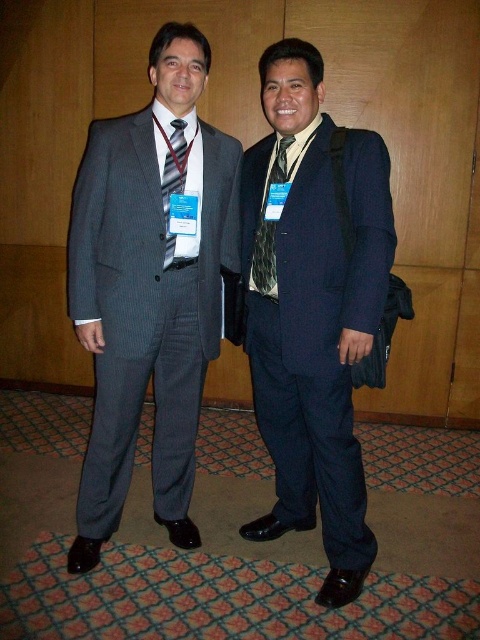
Which is more to the left, gray pinstripe suit at left or patterned silk tie at center?

Positioned to the left is gray pinstripe suit at left.

Where is `gray pinstripe suit at left`? This screenshot has height=640, width=480. gray pinstripe suit at left is located at coordinates (148, 291).

Locate an element on the screen. The height and width of the screenshot is (640, 480). gray pinstripe suit at left is located at coordinates (148, 291).

Can you confirm if gray pinstripe suit at left is thinner than navy blue suit at center?

No.

I want to click on gray pinstripe suit at left, so click(x=148, y=291).

Who is more distant from viewer, (x=186, y=106) or (x=328, y=556)?

The point (x=328, y=556) is behind.

Locate an element on the screen. gray pinstripe suit at left is located at coordinates (148, 291).

The width and height of the screenshot is (480, 640). I want to click on navy blue suit at center, so click(x=312, y=308).

Does navy blue suit at center lie in front of patterned silk tie at center?

That is True.

Where is `navy blue suit at center`? navy blue suit at center is located at coordinates (312, 308).